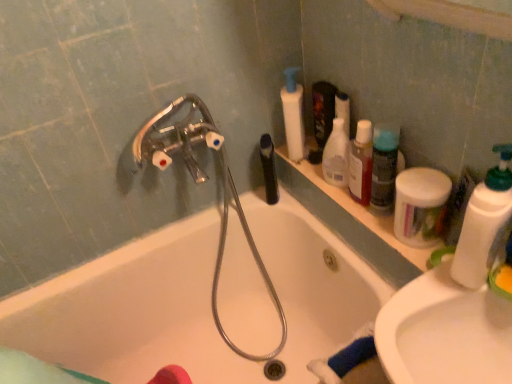
Locate an element on the screen. The width and height of the screenshot is (512, 384). white ceramic bathtub at center is located at coordinates (196, 303).

Describe the element at coordinates (336, 155) in the screenshot. The image size is (512, 384). I see `translucent plastic spray bottle at upper right, acting as the second cleaning product starting from the back` at that location.

Describe the element at coordinates (354, 209) in the screenshot. I see `white plastic bottles at upper right` at that location.

Locate an element on the screen. This screenshot has height=384, width=512. white plastic bottles at upper right is located at coordinates (354, 209).

This screenshot has height=384, width=512. Describe the element at coordinates (269, 169) in the screenshot. I see `black matte bottle at upper center, the first mouthwash when ordered from left to right` at that location.

I want to click on translucent plastic bottle at upper right, the third cleaning product positioned from the back, so click(384, 166).

Considering the positions of points (437, 229) and (154, 299), is point (437, 229) farther from camera compared to point (154, 299)?

No, (437, 229) is in front of (154, 299).

Does white matte jar at upper right, the fourth cleaning product viewed from the back, have a larger size compared to white ceramic bathtub at center?

No, white matte jar at upper right, the fourth cleaning product viewed from the back, is not bigger than white ceramic bathtub at center.

Does white matte jar at upper right, the fourth cleaning product viewed from the back, lie in front of white ceramic bathtub at center?

No, it is not.

Is translucent plastic bottle at upper right, which is the first mouthwash from right to left, not close to translucent plastic bottle at upper right, the third cleaning product positioned from the back?

No, translucent plastic bottle at upper right, which is the first mouthwash from right to left, is not far from translucent plastic bottle at upper right, the third cleaning product positioned from the back.

From a real-world perspective, who is located higher, translucent plastic bottle at upper right, the 2th mouthwash viewed from the back, or translucent plastic bottle at upper right, the third cleaning product positioned from the back?

translucent plastic bottle at upper right, the third cleaning product positioned from the back, is physically above.

Is translucent plastic bottle at upper right, which is the first mouthwash from right to left, bigger or smaller than translucent plastic bottle at upper right, the third cleaning product in the front-to-back sequence?

Clearly, translucent plastic bottle at upper right, which is the first mouthwash from right to left, is smaller in size than translucent plastic bottle at upper right, the third cleaning product in the front-to-back sequence.

Considering the sizes of objects metallic silver garden hose at upper left and translucent plastic bottle at upper right, which is counted as the first mouthwash, starting from the front, in the image provided, who is wider, metallic silver garden hose at upper left or translucent plastic bottle at upper right, which is counted as the first mouthwash, starting from the front,?

With larger width is metallic silver garden hose at upper left.

Is metallic silver garden hose at upper left further to camera compared to translucent plastic bottle at upper right, the 2th mouthwash viewed from the back?

No.

Based on the photo, can you confirm if metallic silver garden hose at upper left is bigger than translucent plastic bottle at upper right, which is counted as the first mouthwash, starting from the front?

Yes, metallic silver garden hose at upper left is bigger than translucent plastic bottle at upper right, which is counted as the first mouthwash, starting from the front.

Which is more to the right, metallic silver garden hose at upper left or translucent plastic bottle at upper right, the 2th mouthwash viewed from the back?

Positioned to the right is translucent plastic bottle at upper right, the 2th mouthwash viewed from the back.

From a real-world perspective, which object stands above the other?

white plastic bottle at right, the 5th cleaning product positioned from the back, from a real-world perspective.

Between point (485, 272) and point (371, 178), which one is positioned behind?

The point (371, 178) is more distant.

The width and height of the screenshot is (512, 384). I want to click on the 2nd cleaning product behind the white plastic bottle at right, the 5th cleaning product positioned from the back, starting your count from the anchor, so click(384, 166).

Is white plastic bottle at right, the 1th cleaning product in the front-to-back sequence, shorter than translucent plastic bottle at upper right, the third cleaning product in the front-to-back sequence?

No, white plastic bottle at right, the 1th cleaning product in the front-to-back sequence, is not shorter than translucent plastic bottle at upper right, the third cleaning product in the front-to-back sequence.

Is white matte jar at upper right, which is the second cleaning product in front-to-back order, next to white glossy sink at lower right?

white matte jar at upper right, which is the second cleaning product in front-to-back order, is not next to white glossy sink at lower right, and they're not touching.

Is white matte jar at upper right, the fourth cleaning product viewed from the back, bigger than white glossy sink at lower right?

Actually, white matte jar at upper right, the fourth cleaning product viewed from the back, might be smaller than white glossy sink at lower right.

Is white glossy sink at lower right a part of white matte jar at upper right, the fourth cleaning product viewed from the back?

No.

Is white ceramic bathtub at center far away from white plastic bottle at right, the 1th cleaning product in the front-to-back sequence?

No, white ceramic bathtub at center is not far away from white plastic bottle at right, the 1th cleaning product in the front-to-back sequence.

Is white ceramic bathtub at center outside of white plastic bottle at right, the 5th cleaning product positioned from the back?

white ceramic bathtub at center lies outside white plastic bottle at right, the 5th cleaning product positioned from the back,'s area.

From a real-world perspective, is white ceramic bathtub at center positioned over white plastic bottle at right, the 1th cleaning product in the front-to-back sequence, based on gravity?

Incorrect, from a real-world perspective, white ceramic bathtub at center is lower than white plastic bottle at right, the 1th cleaning product in the front-to-back sequence.

Which of these two, white ceramic bathtub at center or white plastic bottle at right, the 1th cleaning product in the front-to-back sequence, stands taller?

With more height is white ceramic bathtub at center.

In the image, there is a translucent plastic bottle at upper right, which is the first mouthwash from right to left. Where is `bathtub below it (from a real-world perspective)`? The height and width of the screenshot is (384, 512). bathtub below it (from a real-world perspective) is located at coordinates (196, 303).

From the image's perspective, is white ceramic bathtub at center over translucent plastic bottle at upper right, which is counted as the first mouthwash, starting from the front?

No.

From a real-world perspective, is white ceramic bathtub at center positioned over translucent plastic bottle at upper right, which is counted as the second mouthwash, starting from the left, based on gravity?

No, from a real-world perspective, white ceramic bathtub at center is not above translucent plastic bottle at upper right, which is counted as the second mouthwash, starting from the left.

Could you tell me if white ceramic bathtub at center is facing translucent plastic bottle at upper right, which is the first mouthwash from right to left?

No, white ceramic bathtub at center does not turn towards translucent plastic bottle at upper right, which is the first mouthwash from right to left.

Identify the location of bathtub in front of the white matte jar at upper right, the fourth cleaning product viewed from the back. (196, 303).

The image size is (512, 384). I want to click on the 1st mouthwash behind when counting from the translucent plastic bottle at upper right, the third cleaning product positioned from the back, so [361, 163].

Estimate the real-world distances between objects in this image. Which object is closer to white ceramic bathtub at center, metallic silver garden hose at upper left or translucent plastic spray bottle at upper right, which ranks as the fourth cleaning product in front-to-back order?

Based on the image, metallic silver garden hose at upper left appears to be nearer to white ceramic bathtub at center.

Considering their positions, is black matte bottle at upper center, the 2th mouthwash when ordered from front to back, positioned further to translucent plastic spray bottle at upper right, acting as the second cleaning product starting from the back, than white plastic bottles at upper right?

black matte bottle at upper center, the 2th mouthwash when ordered from front to back, is further to translucent plastic spray bottle at upper right, acting as the second cleaning product starting from the back.

Estimate the real-world distances between objects in this image. Which object is further from white ceramic bathtub at center, metallic silver garden hose at upper left or black matte bottle at upper center, the 2th mouthwash when ordered from front to back?

Based on the image, black matte bottle at upper center, the 2th mouthwash when ordered from front to back, appears to be further to white ceramic bathtub at center.

Looking at the image, which one is located closer to white plastic pump bottle at upper center, which is the first cleaning product in back-to-front order, black matte bottle at upper center, the first mouthwash when ordered from left to right, or translucent plastic bottle at upper right, the third cleaning product positioned from the back?

black matte bottle at upper center, the first mouthwash when ordered from left to right, is positioned closer to the anchor white plastic pump bottle at upper center, which is the first cleaning product in back-to-front order.

From the image, which object appears to be nearer to translucent plastic bottle at upper right, the third cleaning product in the front-to-back sequence, translucent plastic bottle at upper right, the 2th mouthwash viewed from the back, or white glossy sink at lower right?

translucent plastic bottle at upper right, the 2th mouthwash viewed from the back.

Which object lies further to the anchor point white plastic bottle at right, the 1th cleaning product in the front-to-back sequence, white matte jar at upper right, which is the second cleaning product in front-to-back order, or translucent plastic spray bottle at upper right, which ranks as the fourth cleaning product in front-to-back order?

Among the two, translucent plastic spray bottle at upper right, which ranks as the fourth cleaning product in front-to-back order, is located further to white plastic bottle at right, the 1th cleaning product in the front-to-back sequence.

Based on their spatial positions, is translucent plastic bottle at upper right, the third cleaning product positioned from the back, or white matte jar at upper right, which is the second cleaning product in front-to-back order, closer to black matte bottle at upper center, which appears as the 2th mouthwash when viewed from the right?

The object closer to black matte bottle at upper center, which appears as the 2th mouthwash when viewed from the right, is translucent plastic bottle at upper right, the third cleaning product positioned from the back.

Which object lies further to the anchor point metallic silver garden hose at upper left, white glossy sink at lower right or white ceramic bathtub at center?

The object further to metallic silver garden hose at upper left is white glossy sink at lower right.

You are a GUI agent. You are given a task and a screenshot of the screen. Output one action in this format:
    pyautogui.click(x=<x>, y=<y>)
    Task: Click on the garden hose between white plastic bottle at right, the 5th cleaning product positioned from the back, and black matte bottle at upper center, which appears as the 2th mouthwash when viewed from the right, from front to back
    The width and height of the screenshot is (512, 384).
    Given the screenshot: What is the action you would take?
    pyautogui.click(x=201, y=182)

Identify the location of sink between translucent plastic spray bottle at upper right, which ranks as the fourth cleaning product in front-to-back order, and white ceramic bathtub at center vertically. tap(444, 333).

Image resolution: width=512 pixels, height=384 pixels. I want to click on ledge between translucent plastic bottle at upper right, which is the first mouthwash from right to left, and white ceramic bathtub at center vertically, so click(354, 209).

Locate an element on the screen. The image size is (512, 384). garden hose between white glossy sink at lower right and white plastic pump bottle at upper center, which is the first cleaning product in back-to-front order, in the front-back direction is located at coordinates (201, 182).